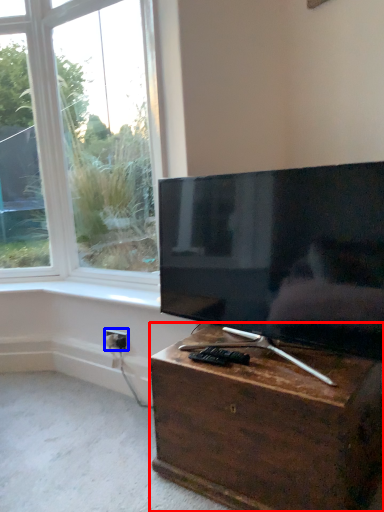
Question: Which of the following is the closest to the observer, nightstand (highlighted by a red box) or electric outlet (highlighted by a blue box)?

Choices:
 (A) nightstand
 (B) electric outlet

Answer: (A)